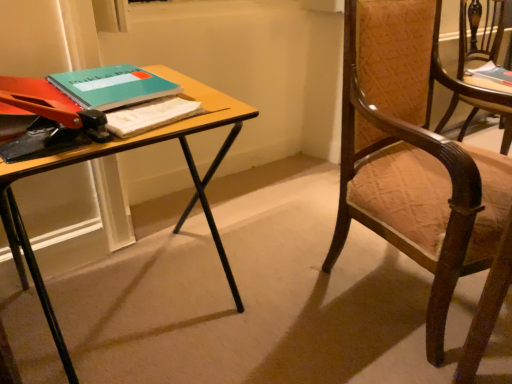
Question: Is teal matte notebook at upper left, which is the first book from bottom to top, bigger than wooden textured chair at right, the second chair from the front?

Choices:
 (A) yes
 (B) no

Answer: (B)

Question: Is teal matte notebook at upper left, the 2th book viewed from the back, touching wooden textured chair at right, the second chair from the front?

Choices:
 (A) no
 (B) yes

Answer: (A)

Question: Does teal matte notebook at upper left, which is the second book in top-to-bottom order, turn towards wooden textured chair at right, acting as the 1th chair starting from the right?

Choices:
 (A) no
 (B) yes

Answer: (A)

Question: Is teal matte notebook at upper left, which ranks as the first book in left-to-right order, behind wooden textured chair at right, the second chair when ordered from left to right?

Choices:
 (A) no
 (B) yes

Answer: (A)

Question: From the image's perspective, is teal matte notebook at upper left, which ranks as the first book in left-to-right order, over wooden textured chair at right, the second chair when ordered from left to right?

Choices:
 (A) yes
 (B) no

Answer: (B)

Question: Considering the relative sizes of teal matte notebook at upper left, which is the second book in top-to-bottom order, and wooden textured chair at right, acting as the 1th chair starting from the right, in the image provided, is teal matte notebook at upper left, which is the second book in top-to-bottom order, shorter than wooden textured chair at right, acting as the 1th chair starting from the right,?

Choices:
 (A) yes
 (B) no

Answer: (A)

Question: From a real-world perspective, does wooden chair with upholstered seat at right, which is counted as the 1th chair, starting from the front, sit lower than wooden desk at center?

Choices:
 (A) yes
 (B) no

Answer: (B)

Question: Would you say wooden chair with upholstered seat at right, positioned as the second chair in right-to-left order, contains wooden desk at center?

Choices:
 (A) yes
 (B) no

Answer: (B)

Question: Can you confirm if wooden chair with upholstered seat at right, positioned as the second chair in right-to-left order, is bigger than wooden desk at center?

Choices:
 (A) yes
 (B) no

Answer: (A)

Question: From the image's perspective, is wooden chair with upholstered seat at right, positioned as the second chair in right-to-left order, beneath wooden desk at center?

Choices:
 (A) yes
 (B) no

Answer: (B)

Question: Is wooden chair with upholstered seat at right, which is counted as the 1th chair, starting from the front, positioned with its back to wooden desk at center?

Choices:
 (A) no
 (B) yes

Answer: (A)

Question: Is wooden chair with upholstered seat at right, which is counted as the 1th chair, starting from the front, beside wooden desk at center?

Choices:
 (A) yes
 (B) no

Answer: (B)

Question: Is teal matte notebook at upper left, arranged as the second book when viewed from the right, far from teal matte book at upper right, positioned as the first book in top-to-bottom order?

Choices:
 (A) yes
 (B) no

Answer: (A)